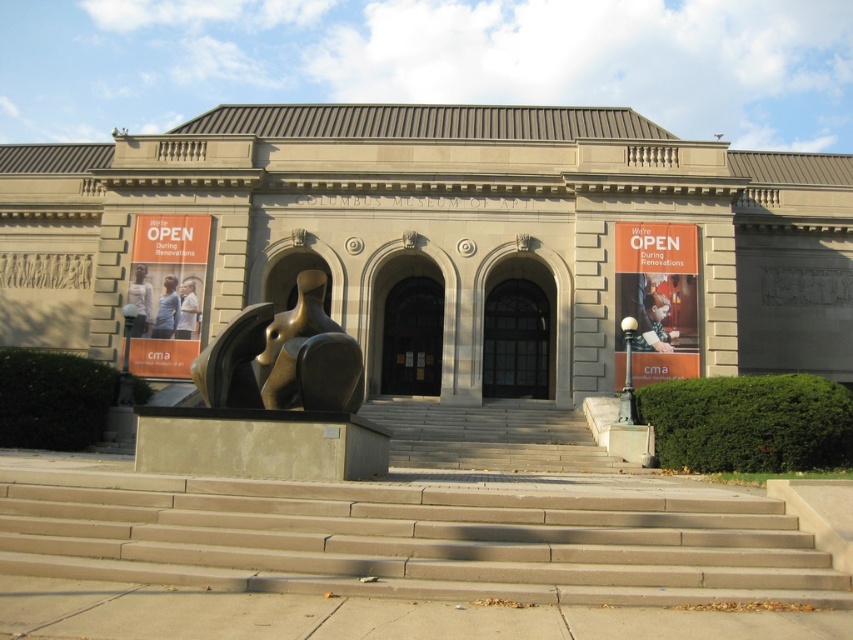
Is light brown leather jacket at center below light brown leather jacket at lower left?

No, light brown leather jacket at center is not below light brown leather jacket at lower left.

How distant is light brown leather jacket at center from light brown leather jacket at lower left?

They are 3.77 meters apart.

Is point (143, 316) less distant than point (190, 307)?

Yes, point (143, 316) is in front of point (190, 307).

Find the location of `light brown leather jacket at center`. light brown leather jacket at center is located at coordinates (140, 300).

Between clear glass door at center and light blue shirt at center, which one appears on the left side from the viewer's perspective?

light blue shirt at center is more to the left.

Is clear glass door at center bigger than light blue shirt at center?

Yes, clear glass door at center is bigger than light blue shirt at center.

Which is in front, point (492, 381) or point (175, 278)?

Point (175, 278) is more forward.

Find the location of a particular element. This screenshot has width=853, height=640. clear glass door at center is located at coordinates (515, 340).

Does clear glass door at center come in front of light brown leather jacket at lower left?

That is False.

Who is higher up, clear glass door at center or light brown leather jacket at lower left?

light brown leather jacket at lower left is higher up.

Does point (508, 358) come behind point (195, 321)?

Yes, point (508, 358) is farther from viewer.

Where is `clear glass door at center`? This screenshot has height=640, width=853. clear glass door at center is located at coordinates [x=515, y=340].